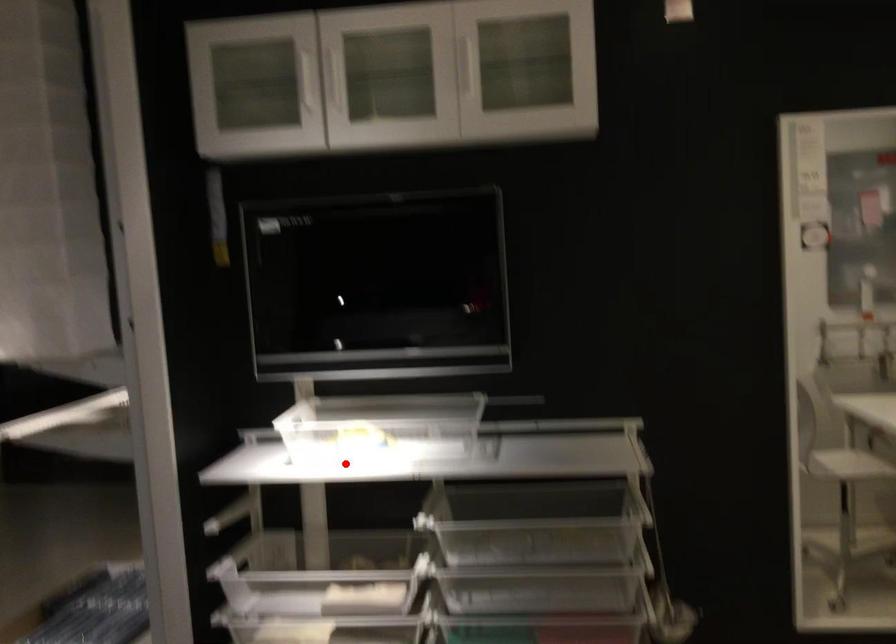
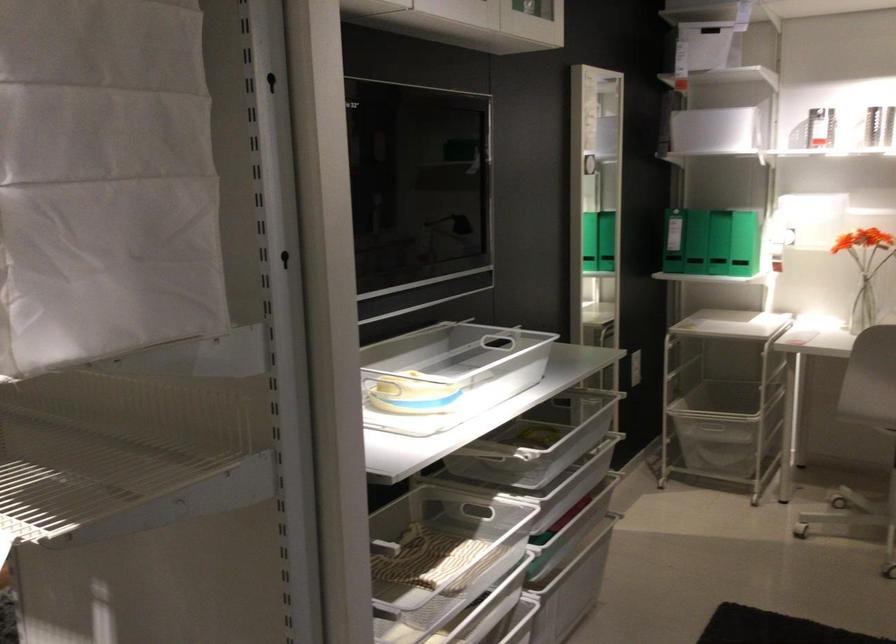
Question: A red point is marked in image1. In image2, is the corresponding 3D point closer to the camera or farther? Reply with the corresponding letter.

Choices:
 (A) The corresponding 3D point is closer.
 (B) The corresponding 3D point is farther.

Answer: (A)